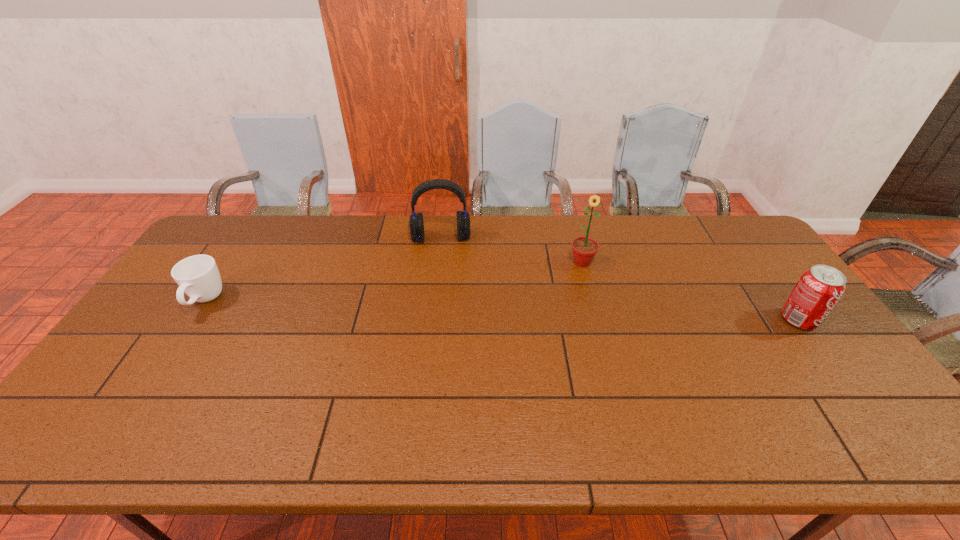
Locate an element on the screen. The height and width of the screenshot is (540, 960). free region at the far edge is located at coordinates (434, 253).

This screenshot has height=540, width=960. In order to click on free spot at the near edge of the desktop in this screenshot , I will do `click(731, 394)`.

Where is `free region at the left edge`? The height and width of the screenshot is (540, 960). free region at the left edge is located at coordinates (237, 264).

Locate an element on the screen. The image size is (960, 540). free space at the near right corner of the desktop is located at coordinates (806, 386).

The image size is (960, 540). Identify the location of free area in between the headset and the cup. (324, 269).

Locate an element on the screen. The height and width of the screenshot is (540, 960). vacant point located between the soda and the tallest object is located at coordinates (690, 291).

I want to click on free space that is in between the rightmost object and the cup, so click(502, 310).

Locate an element on the screen. empty space that is in between the second tallest object and the cup is located at coordinates tap(324, 269).

I want to click on free space between the shortest object and the second shortest object, so click(x=502, y=310).

Where is `empty space between the farthest object and the leftmost object`? empty space between the farthest object and the leftmost object is located at coordinates (324, 269).